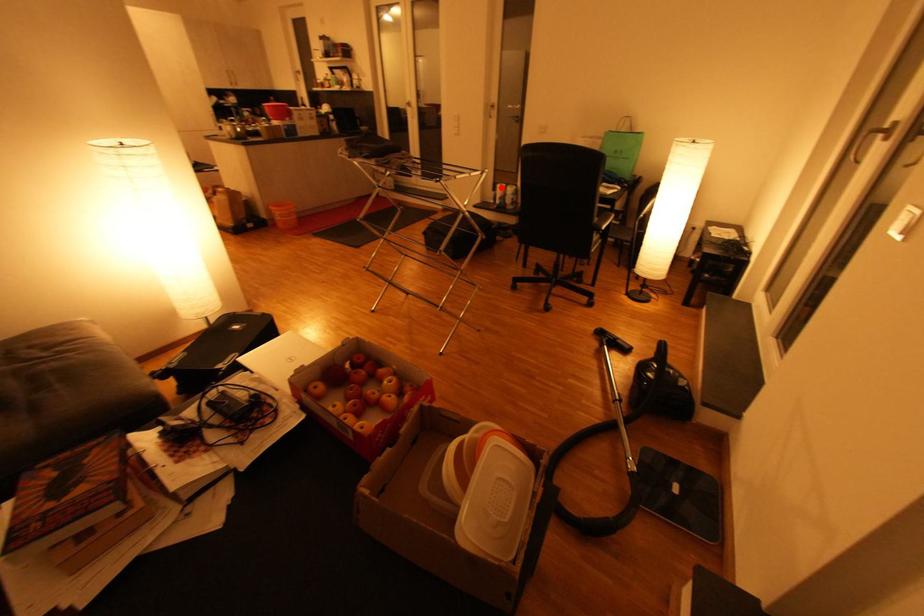
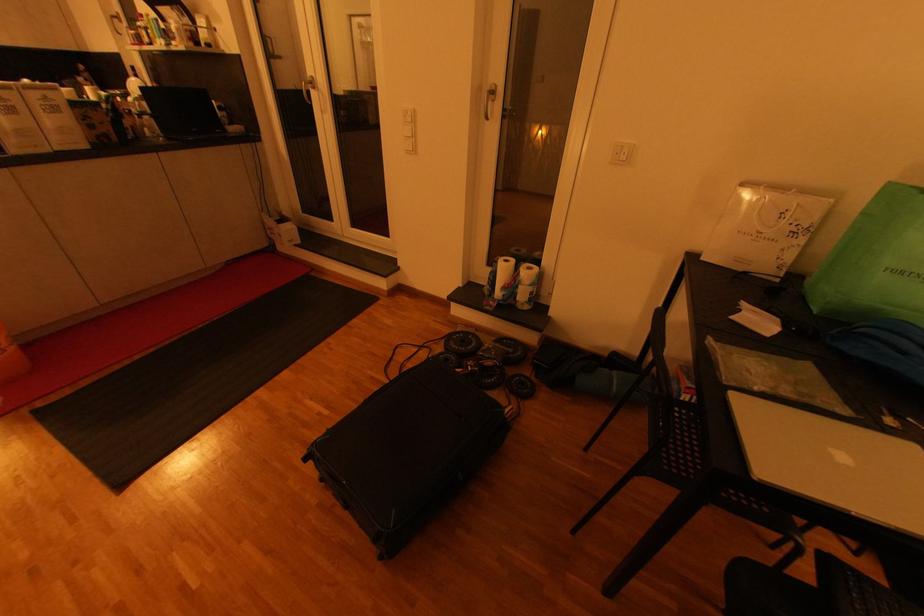
Locate, in the second image, the point that corresponds to the highlighted location in the first image.

(502, 262)